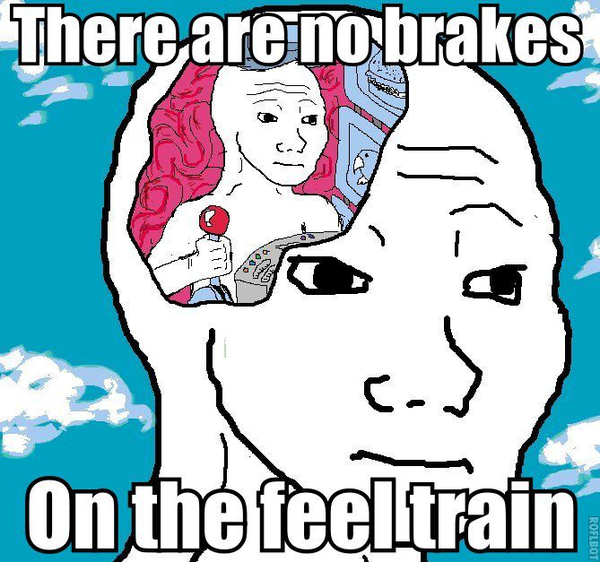
Identify the location of control panel. (271, 253).